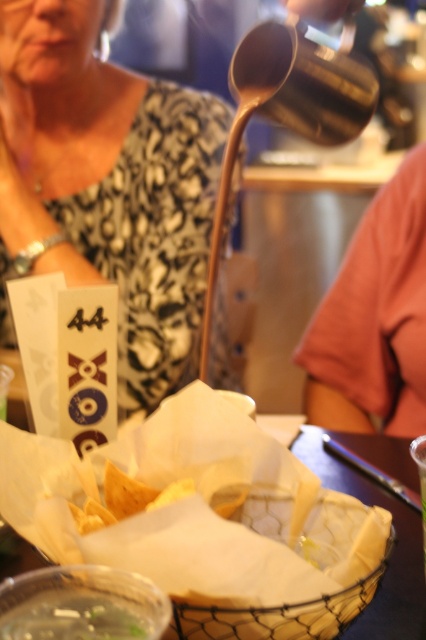
You are at a restaurant and need to place a small decorative item exactly at the point labeled as point (108, 186). According to the scene, where should you place it?

The point (108, 186) is located on the matte black shirt at upper left, so you should place the item on the matte black shirt at upper left.